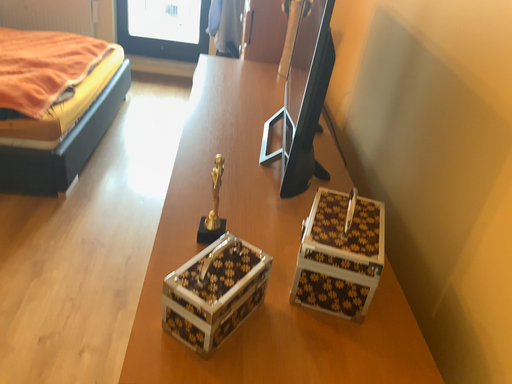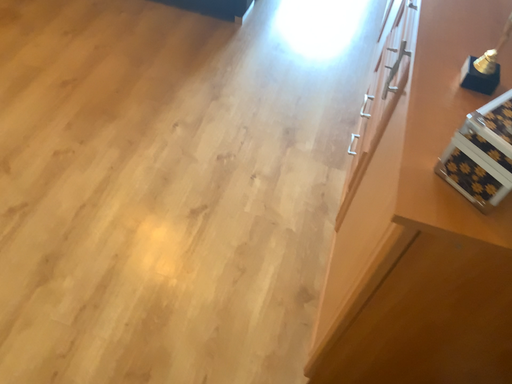
Question: How did the camera likely rotate when shooting the video?

Choices:
 (A) rotated downward
 (B) rotated upward

Answer: (A)